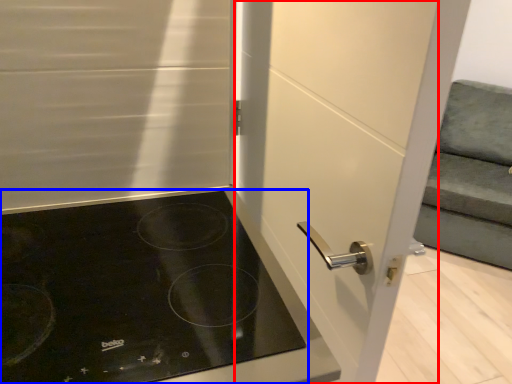
Question: Which of the following is the farthest to the observer, screen door (highlighted by a red box) or gas stove (highlighted by a blue box)?

Choices:
 (A) screen door
 (B) gas stove

Answer: (A)